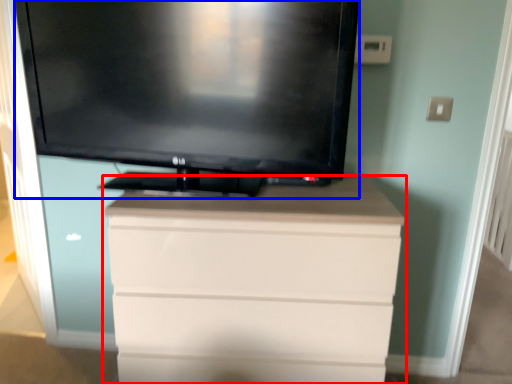
Question: Which of the following is the farthest to the observer, chest of drawers (highlighted by a red box) or television (highlighted by a blue box)?

Choices:
 (A) chest of drawers
 (B) television

Answer: (A)